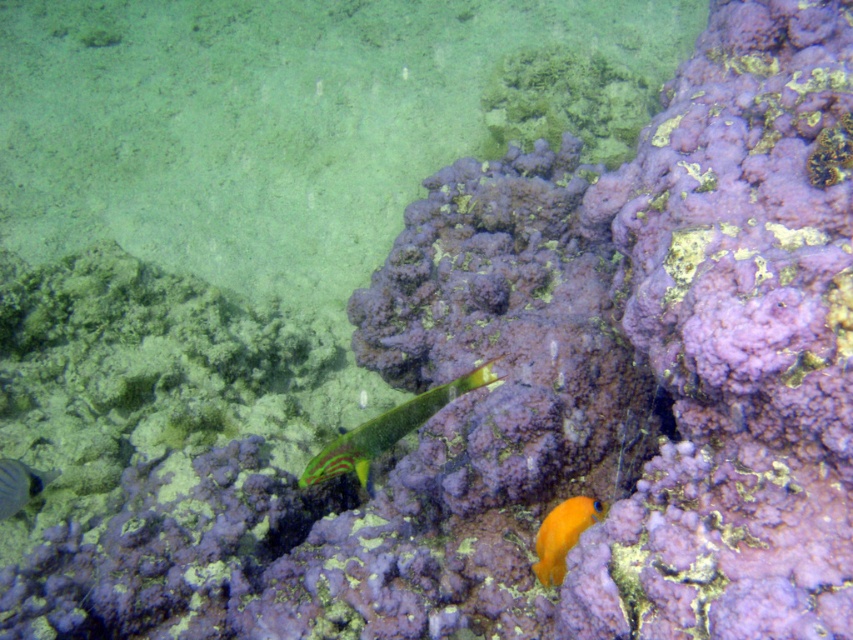
Can you confirm if orange matte fish at lower right is taller than shiny silver fish at lower left?

Yes, orange matte fish at lower right is taller than shiny silver fish at lower left.

Does orange matte fish at lower right appear on the left side of shiny silver fish at lower left?

Incorrect, orange matte fish at lower right is not on the left side of shiny silver fish at lower left.

Does point (585, 506) come farther from viewer compared to point (27, 481)?

That is False.

The width and height of the screenshot is (853, 640). Find the location of `orange matte fish at lower right`. orange matte fish at lower right is located at coordinates point(561,536).

Looking at this image, which is more to the left, green glossy fish at center or orange matte fish at lower right?

From the viewer's perspective, green glossy fish at center appears more on the left side.

Can you confirm if green glossy fish at center is taller than orange matte fish at lower right?

Correct, green glossy fish at center is much taller as orange matte fish at lower right.

Is point (390, 435) positioned after point (572, 522)?

No, it is not.

I want to click on green glossy fish at center, so click(x=387, y=429).

Does green glossy fish at center have a larger size compared to shiny silver fish at lower left?

Yes, green glossy fish at center is bigger than shiny silver fish at lower left.

What are the coordinates of `green glossy fish at center` in the screenshot? It's located at (387, 429).